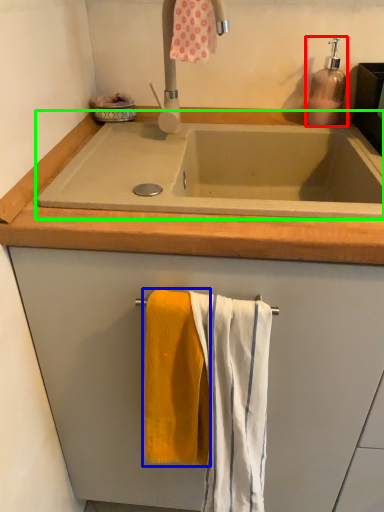
Question: Considering the real-world distances, which object is farthest from soap dispenser (highlighted by a red box)? bath towel (highlighted by a blue box) or bath (highlighted by a green box)?

Choices:
 (A) bath towel
 (B) bath

Answer: (A)